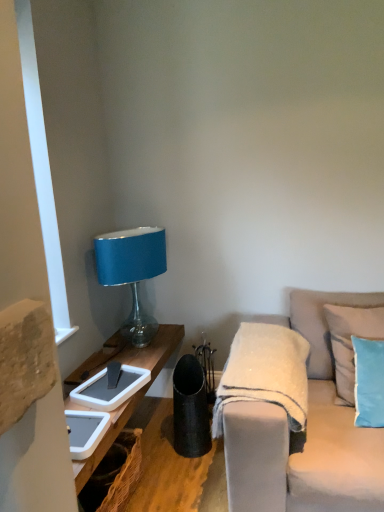
This screenshot has width=384, height=512. What are the coordinates of `vacant space situated above light blue fabric pillow at right, the first pillow when ordered from front to back (from a real-world perspective)` in the screenshot? It's located at (369, 332).